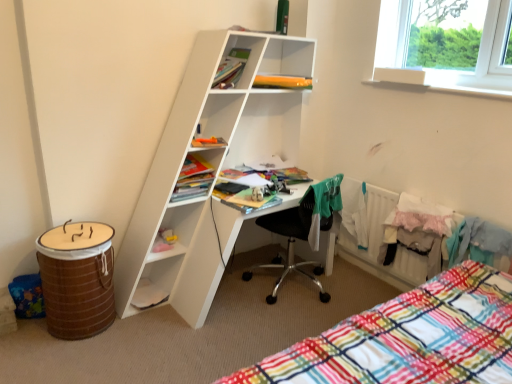
Describe the element at coordinates (148, 295) in the screenshot. I see `white matte book at lower left, which appears as the 1th book when ordered from the bottom` at that location.

This screenshot has width=512, height=384. Describe the element at coordinates (211, 164) in the screenshot. I see `white matte desk at center` at that location.

Locate an element on the screen. The width and height of the screenshot is (512, 384). green fabric shirt at center is located at coordinates (324, 205).

The height and width of the screenshot is (384, 512). What do you see at coordinates (208, 142) in the screenshot?
I see `orange matte book at center, which is the third book from top to bottom` at bounding box center [208, 142].

In order to face black mesh chair at center, should I rotate leftwards or rightwards?

Rotate right and turn 5.546 degrees.

In order to face orange plastic bag at upper center, arranged as the second book when viewed from the top, should I rotate leftwards or rightwards?

It's best to rotate right around 3.834 degrees.

Locate an element on the screen. Image resolution: width=512 pixels, height=384 pixels. white matte book at lower left, which appears as the 1th book when ordered from the bottom is located at coordinates (148, 295).

What's the angular difference between brown woven barrel at lower left and white matte desk at center's facing directions?

There is a 0.00115-degree angle between the facing directions of brown woven barrel at lower left and white matte desk at center.

Between point (95, 274) and point (220, 205), which one is positioned in front?

The point (95, 274) is closer.

Does brown woven barrel at lower left have a greater height compared to white matte desk at center?

No, brown woven barrel at lower left is not taller than white matte desk at center.

From a real-world perspective, is brown woven barrel at lower left positioned under white matte desk at center based on gravity?

Yes, from a real-world perspective, brown woven barrel at lower left is beneath white matte desk at center.

Is black mesh chair at center inside the boundaries of matte yellow book at center, arranged as the fourth book when viewed from the top, or outside?

black mesh chair at center lies outside matte yellow book at center, arranged as the fourth book when viewed from the top.

The width and height of the screenshot is (512, 384). Identify the location of chair below the matte yellow book at center, which appears as the 2th book when ordered from the bottom (from the image's perspective). (301, 229).

Which of these two, black mesh chair at center or matte yellow book at center, which appears as the 2th book when ordered from the bottom, stands taller?

Standing taller between the two is black mesh chair at center.

Is black mesh chair at center positioned before matte yellow book at center, arranged as the fourth book when viewed from the top?

Yes, it is in front of matte yellow book at center, arranged as the fourth book when viewed from the top.

Is green fabric shirt at center looking in the opposite direction of matte green book at upper center, which is the fifth book from bottom to top?

green fabric shirt at center is not turned away from matte green book at upper center, which is the fifth book from bottom to top.

Could you measure the distance between green fabric shirt at center and matte green book at upper center, which is the 1th book from top to bottom?

green fabric shirt at center and matte green book at upper center, which is the 1th book from top to bottom, are 34.15 inches apart from each other.

Is matte green book at upper center, which is the fifth book from bottom to top, a part of green fabric shirt at center?

No, matte green book at upper center, which is the fifth book from bottom to top, is located outside of green fabric shirt at center.

From the image's perspective, is green fabric shirt at center on matte green book at upper center, which is the fifth book from bottom to top?

Actually, green fabric shirt at center appears below matte green book at upper center, which is the fifth book from bottom to top, in the image.

Find the location of `book that is the 3rd one above the brown woven barrel at lower left (from a real-world perspective)`. book that is the 3rd one above the brown woven barrel at lower left (from a real-world perspective) is located at coordinates (282, 82).

Does orange plastic bag at upper center, which ranks as the 4th book in bottom-to-top order, lie behind brown woven barrel at lower left?

That is True.

Can you confirm if orange plastic bag at upper center, arranged as the second book when viewed from the top, is positioned to the left of brown woven barrel at lower left?

Incorrect, orange plastic bag at upper center, arranged as the second book when viewed from the top, is not on the left side of brown woven barrel at lower left.

Does point (286, 84) come closer to viewer compared to point (70, 317)?

No, (286, 84) is further to viewer.

Does white matte desk at center have a greater height compared to orange plastic bag at upper center, which ranks as the 4th book in bottom-to-top order?

Yes.

In the scene shown: Is orange plastic bag at upper center, which ranks as the 4th book in bottom-to-top order, completely or partially inside white matte desk at center?

That's correct, orange plastic bag at upper center, which ranks as the 4th book in bottom-to-top order, is inside white matte desk at center.

From a real-world perspective, is white matte desk at center on top of orange plastic bag at upper center, arranged as the second book when viewed from the top?

No, from a real-world perspective, white matte desk at center is not over orange plastic bag at upper center, arranged as the second book when viewed from the top

Between white matte desk at center and orange plastic bag at upper center, which ranks as the 4th book in bottom-to-top order, which one has smaller width?

orange plastic bag at upper center, which ranks as the 4th book in bottom-to-top order.

From a real-world perspective, is matte yellow book at center, arranged as the fourth book when viewed from the top, below white matte desk at center?

Indeed, from a real-world perspective, matte yellow book at center, arranged as the fourth book when viewed from the top, is positioned beneath white matte desk at center.

Could white matte desk at center be considered to be inside matte yellow book at center, which appears as the 2th book when ordered from the bottom?

No, matte yellow book at center, which appears as the 2th book when ordered from the bottom, does not contain white matte desk at center.

Which is in front, point (199, 171) or point (260, 158)?

The point (199, 171) is more forward.

Which object is closer to the camera, matte yellow book at center, which appears as the 2th book when ordered from the bottom, or white matte desk at center?

white matte desk at center is closer to the camera.

Is orange matte book at center, the third book when ordered from bottom to top, facing away from green fabric shirt at center?

No.

Is orange matte book at center, the third book when ordered from bottom to top, positioned beyond the bounds of green fabric shirt at center?

Absolutely, orange matte book at center, the third book when ordered from bottom to top, is external to green fabric shirt at center.

Is orange matte book at center, which is the third book from top to bottom, thinner than green fabric shirt at center?

Yes.

How many degrees apart are the facing directions of orange matte book at center, the third book when ordered from bottom to top, and green fabric shirt at center?

They differ by 33.6 degrees in their facing directions.

Where is `shelf above the brown woven barrel at lower left (from a real-world perspective)`? The width and height of the screenshot is (512, 384). shelf above the brown woven barrel at lower left (from a real-world perspective) is located at coordinates (211, 164).

From the image's perspective, which book is the 1st one above the black mesh chair at center? Please provide its 2D coordinates.

[(193, 179)]

From the picture: Estimate the real-world distances between objects in this image. Which object is further from white matte desk at center, brown woven barrel at lower left or orange plastic bag at upper center, which ranks as the 4th book in bottom-to-top order?

orange plastic bag at upper center, which ranks as the 4th book in bottom-to-top order, is positioned further to the anchor white matte desk at center.

Considering their positions, is white matte book at lower left, which appears as the 1th book when ordered from the bottom, positioned further to brown woven barrel at lower left than green fabric shirt at center?

green fabric shirt at center lies further to brown woven barrel at lower left than the other object.

Considering their positions, is black mesh chair at center positioned closer to white plastic radiator at lower right than matte green book at upper center, which is the fifth book from bottom to top?

black mesh chair at center lies closer to white plastic radiator at lower right than the other object.

Considering their positions, is green fabric shirt at center positioned further to orange matte book at center, the third book when ordered from bottom to top, than brown woven barrel at lower left?

brown woven barrel at lower left is further to orange matte book at center, the third book when ordered from bottom to top.

Considering their positions, is orange plastic bag at upper center, arranged as the second book when viewed from the top, positioned closer to white plastic radiator at lower right than matte yellow book at center, arranged as the fourth book when viewed from the top?

orange plastic bag at upper center, arranged as the second book when viewed from the top, is closer to white plastic radiator at lower right.

When comparing their distances from brown woven barrel at lower left, does black mesh chair at center or orange matte book at center, which is the third book from top to bottom, seem further?

The object further to brown woven barrel at lower left is black mesh chair at center.

Estimate the real-world distances between objects in this image. Which object is closer to white matte book at lower left, which appears as the 1th book when ordered from the bottom, black mesh chair at center or orange plastic bag at upper center, arranged as the second book when viewed from the top?

The object closer to white matte book at lower left, which appears as the 1th book when ordered from the bottom, is black mesh chair at center.

Looking at this image, based on their spatial positions, is orange matte book at center, the third book when ordered from bottom to top, or white matte desk at center further from matte yellow book at center, which appears as the 2th book when ordered from the bottom?

Among the two, white matte desk at center is located further to matte yellow book at center, which appears as the 2th book when ordered from the bottom.

Locate an element on the screen. clothing between matte green book at upper center, which is the 1th book from top to bottom, and white matte book at lower left, which appears as the 1th book when ordered from the bottom, from top to bottom is located at coordinates (324, 205).

Where is `chair between orange plastic bag at upper center, which ranks as the 4th book in bottom-to-top order, and white plastic radiator at lower right from top to bottom`? chair between orange plastic bag at upper center, which ranks as the 4th book in bottom-to-top order, and white plastic radiator at lower right from top to bottom is located at coordinates (301, 229).

Identify the location of shelf between matte yellow book at center, which appears as the 2th book when ordered from the bottom, and green fabric shirt at center, in the horizontal direction. Image resolution: width=512 pixels, height=384 pixels. (211, 164).

Where is `book between white matte desk at center and matte yellow book at center, arranged as the fourth book when viewed from the top, from front to back`? This screenshot has height=384, width=512. book between white matte desk at center and matte yellow book at center, arranged as the fourth book when viewed from the top, from front to back is located at coordinates (231, 68).